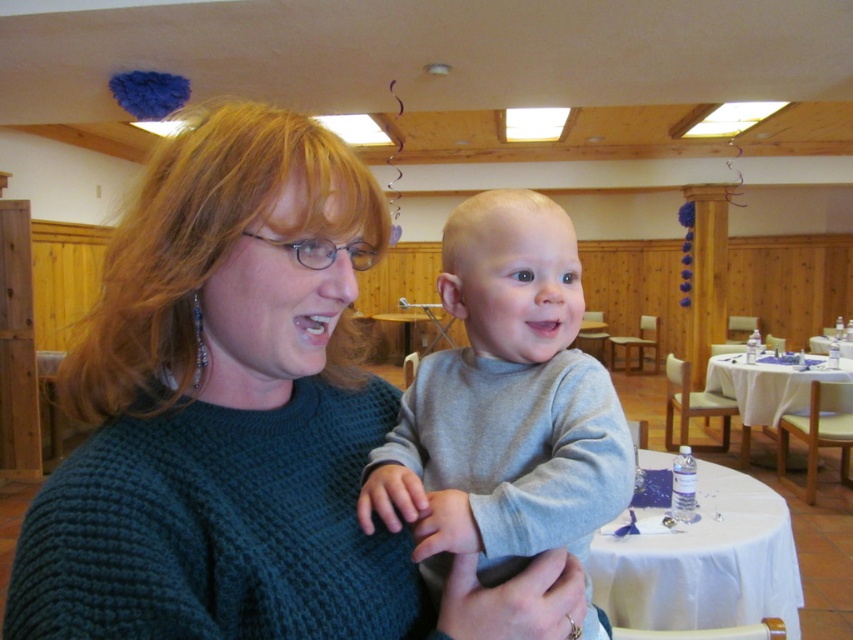
Question: Which object appears farthest from the camera in this image?

Choices:
 (A) knitted dark green sweater at center
 (B) gray cotton shirt at center

Answer: (B)

Question: Is knitted dark green sweater at center below gray cotton shirt at center?

Choices:
 (A) no
 (B) yes

Answer: (A)

Question: Among these objects, which one is farthest from the camera?

Choices:
 (A) knitted dark green sweater at center
 (B) gray cotton shirt at center

Answer: (B)

Question: Where is knitted dark green sweater at center located in relation to gray cotton shirt at center in the image?

Choices:
 (A) below
 (B) above

Answer: (B)

Question: Which point appears farthest from the camera in this image?

Choices:
 (A) (190, 579)
 (B) (505, 230)

Answer: (B)

Question: Does knitted dark green sweater at center appear under gray cotton shirt at center?

Choices:
 (A) no
 (B) yes

Answer: (A)